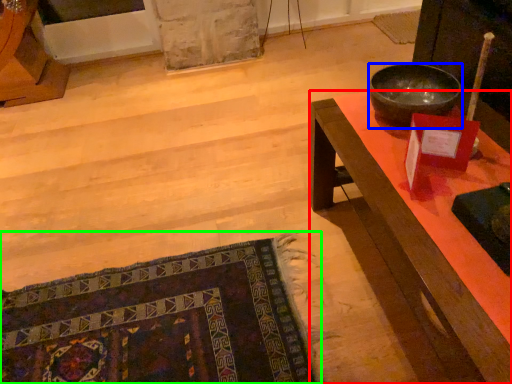
Question: Estimate the real-world distances between objects in this image. Which object is farther from desk (highlighted by a red box), bowl (highlighted by a blue box) or mat (highlighted by a green box)?

Choices:
 (A) bowl
 (B) mat

Answer: (B)